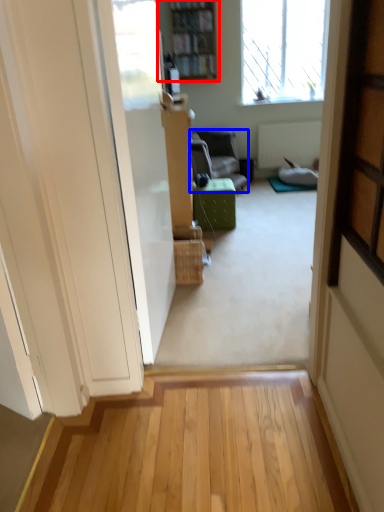
Question: Which object appears closest to the camera in this image, bookcase (highlighted by a red box) or furniture (highlighted by a blue box)?

Choices:
 (A) bookcase
 (B) furniture

Answer: (B)